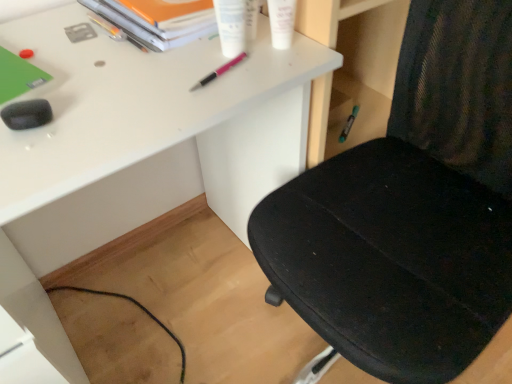
Where is `vacant space that's between white plastic tubes at upper center, the fourth stationery positioned from the back, and matte black earbuds at left, the 1th stationery in the front-to-back sequence`? vacant space that's between white plastic tubes at upper center, the fourth stationery positioned from the back, and matte black earbuds at left, the 1th stationery in the front-to-back sequence is located at coordinates (130, 84).